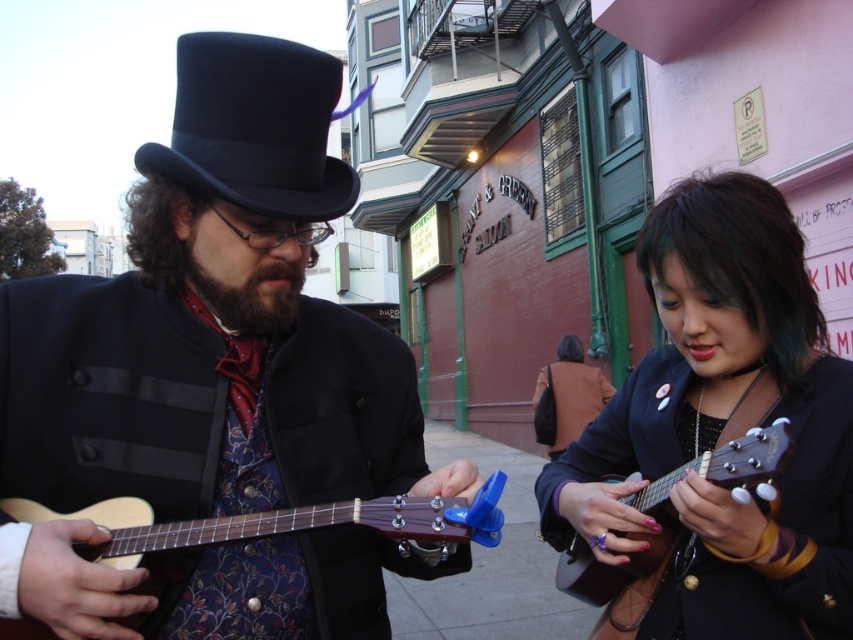
Question: Which of the following is the closest to the observer?

Choices:
 (A) brown fuzzy beard at center
 (B) wooden acoustic guitar at center
 (C) black felt top hat at upper left

Answer: (B)

Question: From the image, what is the correct spatial relationship of black felt top hat at upper left in relation to matte black ukulele at lower right?

Choices:
 (A) left
 (B) right

Answer: (A)

Question: Which of the following is the closest to the observer?

Choices:
 (A) (741, 387)
 (B) (177, 164)

Answer: (B)

Question: Which point is closer to the camera taking this photo?

Choices:
 (A) (645, 420)
 (B) (666, 490)
 (C) (109, 502)
 (D) (199, 42)

Answer: (D)

Question: Is matte black ukulele at right smaller than matte black ukulele at lower right?

Choices:
 (A) no
 (B) yes

Answer: (A)

Question: Does matte black ukulele at lower right appear under brown fuzzy beard at center?

Choices:
 (A) yes
 (B) no

Answer: (A)